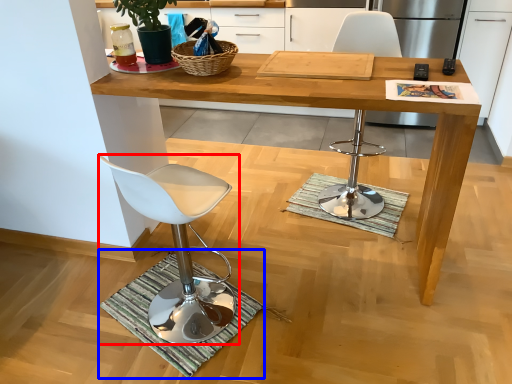
Question: Which point is further to the camera, chair (highlighted by a red box) or doormat (highlighted by a blue box)?

Choices:
 (A) chair
 (B) doormat

Answer: (B)